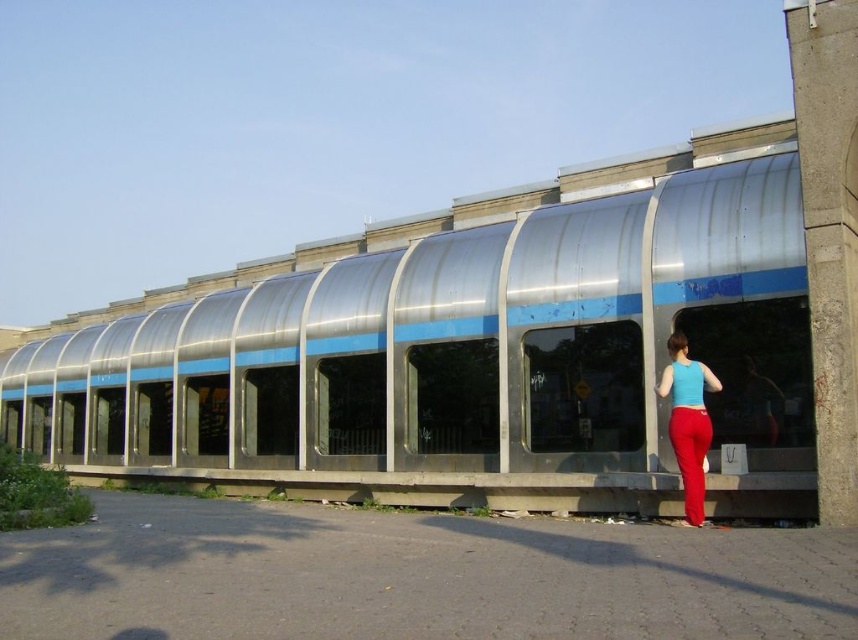
You are a pedestrian standing on the paved area in front of the building. You see the metallic silver train at center and the matte blue tank top at center. Which object is closer to the ground?

The metallic silver train at center is closer to the ground because it is positioned below the matte blue tank top at center.

You are a photographer planning to take a picture of the metallic silver train at center and the matte blue tank top at center. Which object should you focus on first if you want to capture both in the frame without moving the camera?

You should focus on the metallic silver train at center first because it is larger in size than the matte blue tank top at center, making it more prominent in the frame.

You are a delivery person who needs to place a package on the ground between the metallic silver train at center and the matte blue tank top at center. The package requires 3 meters of space to be safely placed. Is there enough space between them for the package?

The metallic silver train at center and the matte blue tank top at center are 5.01 meters apart from each other, so yes, there is enough space between them to safely place the package requiring 3 meters of space.